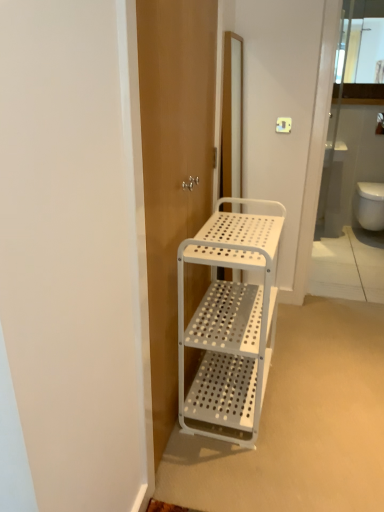
You are a GUI agent. You are given a task and a screenshot of the screen. Output one action in this format:
    pyautogui.click(x=<x>, y=<y>)
    Task: Click on the vacant area that lies to the right of white perforated metal cart at center
    The height and width of the screenshot is (512, 384).
    Given the screenshot: What is the action you would take?
    pyautogui.click(x=316, y=397)